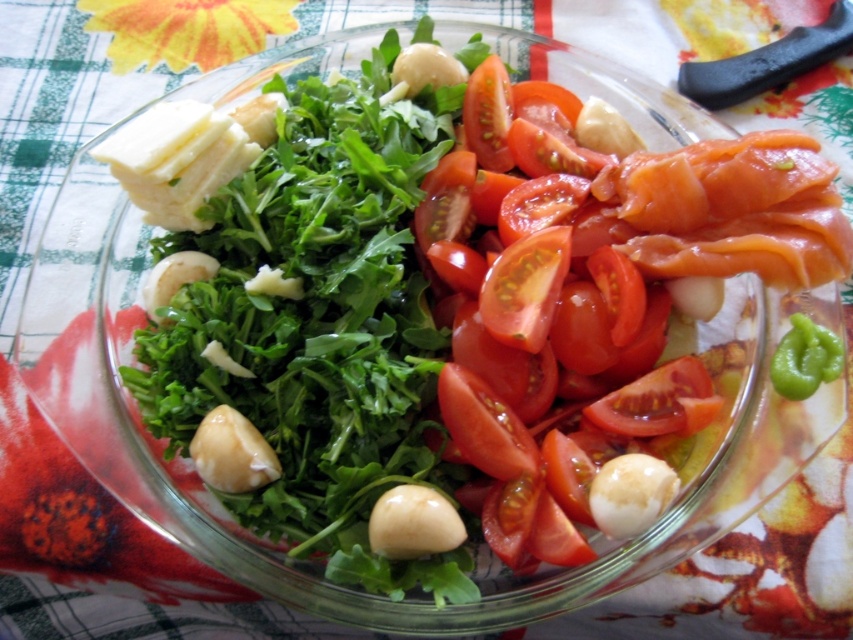
You are a chef who wants to add a garnish to the salad. The garnish must be placed exactly at the point marked by the coordinates point [491,163]. However, you have a limited reach and can only extend your hand 25 inches from your position. Can you safely place the garnish at that point without stretching too far?

The point [491,163] is 27.79 inches from the viewer. Since your reach is limited to 25 inches, you cannot safely place the garnish at that point without stretching beyond your reach.

You are a chef preparing a dish and need to stack ingredients vertically. You have a glossy red tomato at center and a green matte pepper at lower right. Which ingredient should you choose if you need the tallest one for the base of your stack?

The glossy red tomato at center is taller than the green matte pepper at lower right, so you should choose the glossy red tomato at center as the base for your stack since it has greater height.